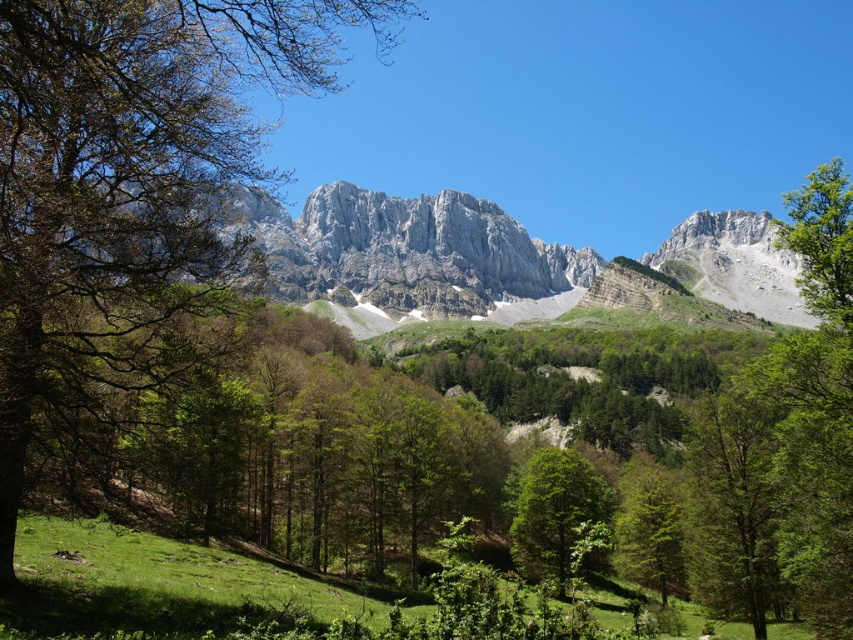
Can you confirm if green leafy tree at center is positioned to the left of green leafy tree at lower right?

Yes, green leafy tree at center is to the left of green leafy tree at lower right.

Is green leafy tree at center further to camera compared to green leafy tree at lower right?

No, green leafy tree at center is closer to the viewer.

Does point (534, 576) come in front of point (648, 561)?

No, (534, 576) is further to viewer.

I want to click on green leafy tree at center, so click(x=554, y=513).

Can you confirm if green leafy tree at left is bigger than green leafy tree at center?

Yes.

Can you confirm if green leafy tree at left is positioned to the left of green leafy tree at center?

Yes, green leafy tree at left is to the left of green leafy tree at center.

Is point (41, 365) in front of point (543, 572)?

That is True.

Where is `green leafy tree at left`? green leafy tree at left is located at coordinates (131, 177).

Who is lower down, green leafy tree at left or gray rocky mountain at center?

gray rocky mountain at center is lower down.

Is green leafy tree at left taller than gray rocky mountain at center?

Yes, green leafy tree at left is taller than gray rocky mountain at center.

Describe the element at coordinates (131, 177) in the screenshot. The image size is (853, 640). I see `green leafy tree at left` at that location.

Find the location of a particular element. green leafy tree at left is located at coordinates (131, 177).